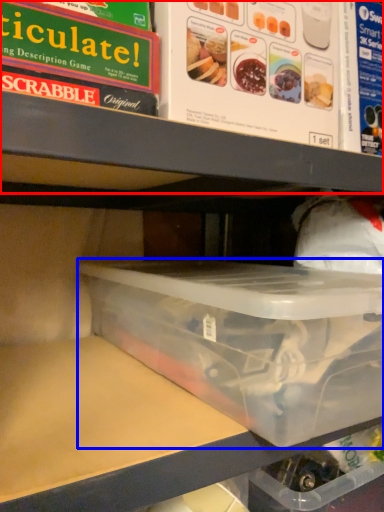
Question: Which point is further to the camera, shelf (highlighted by a red box) or box (highlighted by a blue box)?

Choices:
 (A) shelf
 (B) box

Answer: (A)